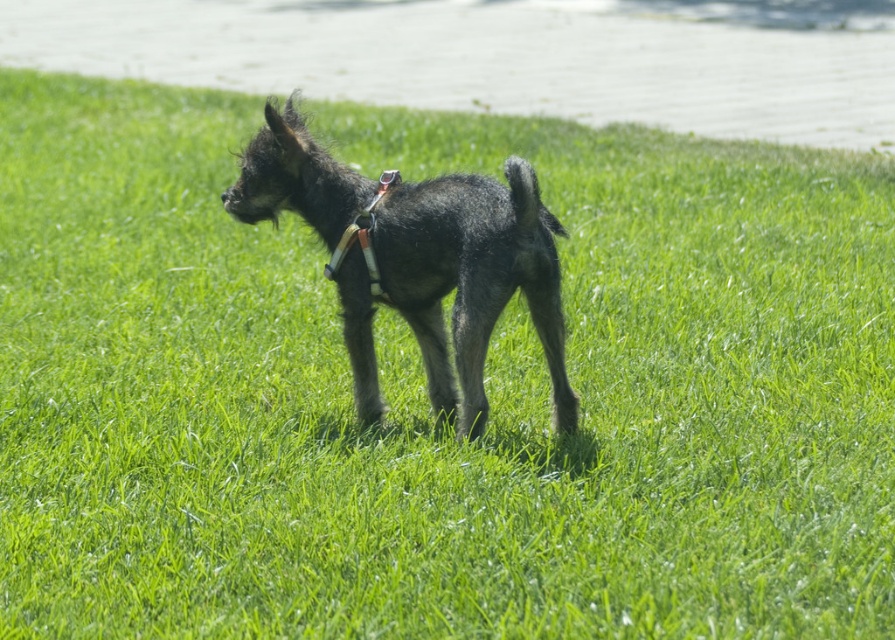
What are the coordinates of the white leather neckband at center?

The white leather neckband at center is located at point (363, 236).

You are a photographer trying to capture the perfect shot of the dog. You notice a specific point in the image at coordinates (412, 262). What object is located at that point?

The point at coordinates (412, 262) indicates the shiny black dog at center.

You are a dog trainer assessing the dog in the image. You need to determine if the white leather neckband at center is suitable for the dog based on its width compared to the black fuzzy tail at center. Can you confirm if the neckband is wider than the tail?

The white leather neckband at center might be wider than black fuzzy tail at center, so it is possible that the neckband is wider. However, the exact width difference is uncertain.